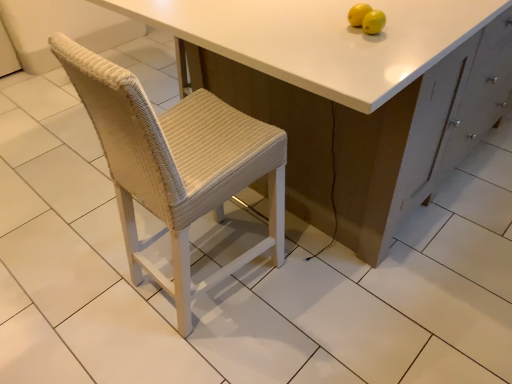
Question: Is yellow matte lemons at upper right surrounded by matte white cabinet at center?

Choices:
 (A) no
 (B) yes

Answer: (A)

Question: Considering the relative positions of matte white cabinet at center and yellow matte lemons at upper right in the image provided, is matte white cabinet at center to the left of yellow matte lemons at upper right from the viewer's perspective?

Choices:
 (A) yes
 (B) no

Answer: (B)

Question: Can you confirm if matte white cabinet at center is wider than yellow matte lemons at upper right?

Choices:
 (A) yes
 (B) no

Answer: (A)

Question: Considering the relative sizes of matte white cabinet at center and yellow matte lemons at upper right in the image provided, is matte white cabinet at center smaller than yellow matte lemons at upper right?

Choices:
 (A) yes
 (B) no

Answer: (B)

Question: From a real-world perspective, is matte white cabinet at center below yellow matte lemons at upper right?

Choices:
 (A) no
 (B) yes

Answer: (B)

Question: Considering the relative sizes of matte white cabinet at center and yellow matte lemons at upper right in the image provided, is matte white cabinet at center thinner than yellow matte lemons at upper right?

Choices:
 (A) no
 (B) yes

Answer: (A)

Question: From a real-world perspective, is yellow matte lemons at upper right physically below matte white cabinet at center?

Choices:
 (A) no
 (B) yes

Answer: (A)

Question: Can you confirm if yellow matte lemons at upper right is thinner than matte white cabinet at center?

Choices:
 (A) no
 (B) yes

Answer: (B)

Question: Can you confirm if yellow matte lemons at upper right is wider than matte white cabinet at center?

Choices:
 (A) no
 (B) yes

Answer: (A)

Question: Is the position of yellow matte lemons at upper right more distant than that of matte white cabinet at center?

Choices:
 (A) yes
 (B) no

Answer: (A)

Question: Does yellow matte lemons at upper right have a larger size compared to matte white cabinet at center?

Choices:
 (A) yes
 (B) no

Answer: (B)

Question: Considering the relative positions of yellow matte lemons at upper right and matte white cabinet at center in the image provided, is yellow matte lemons at upper right to the right of matte white cabinet at center from the viewer's perspective?

Choices:
 (A) no
 (B) yes

Answer: (A)

Question: Is matte white cabinet at center in front of or behind yellow matte lemons at upper right in the image?

Choices:
 (A) front
 (B) behind

Answer: (A)